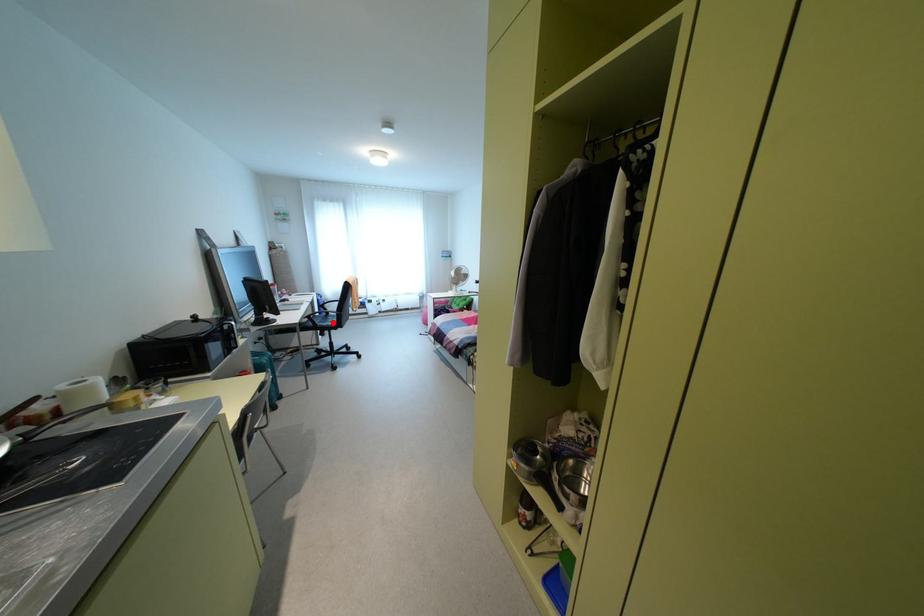
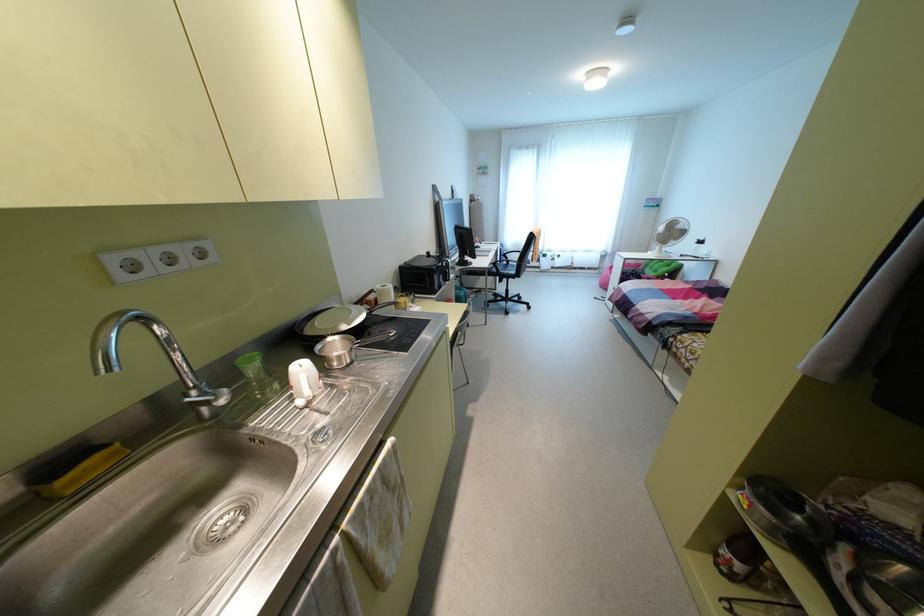
Locate, in the second image, the point that corresponds to the highlighted location in the first image.

(513, 272)